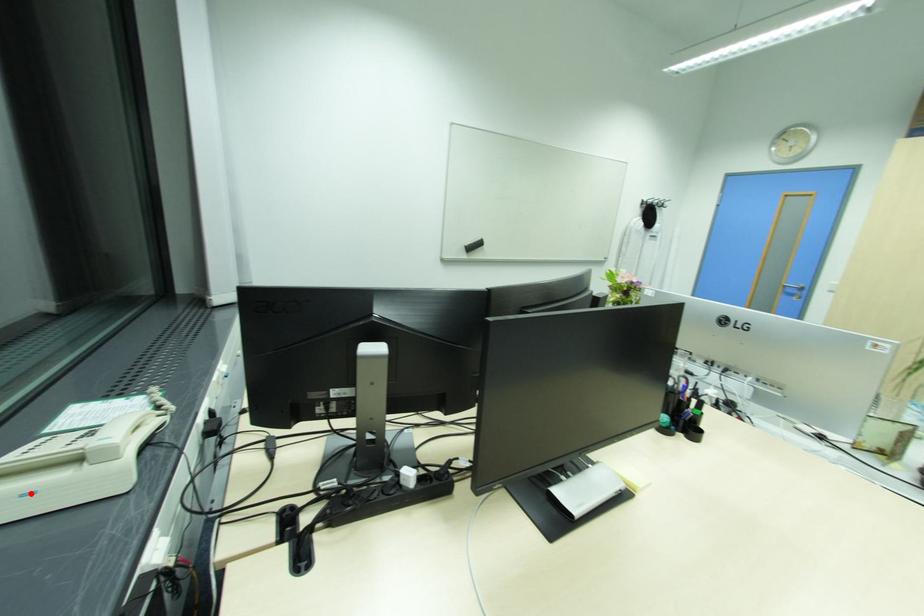
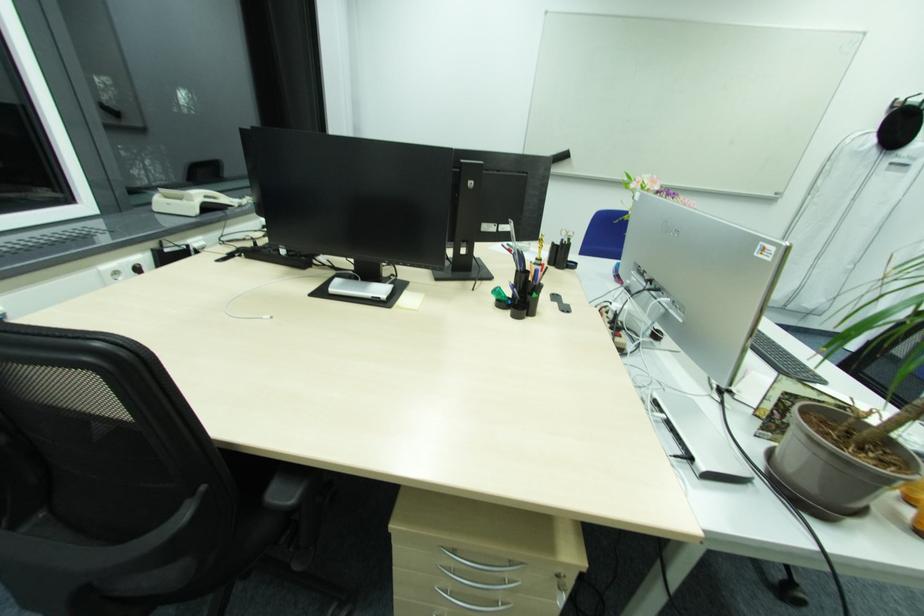
The point at the highlighted location is marked in the first image. Where is the corresponding point in the second image?

(174, 205)